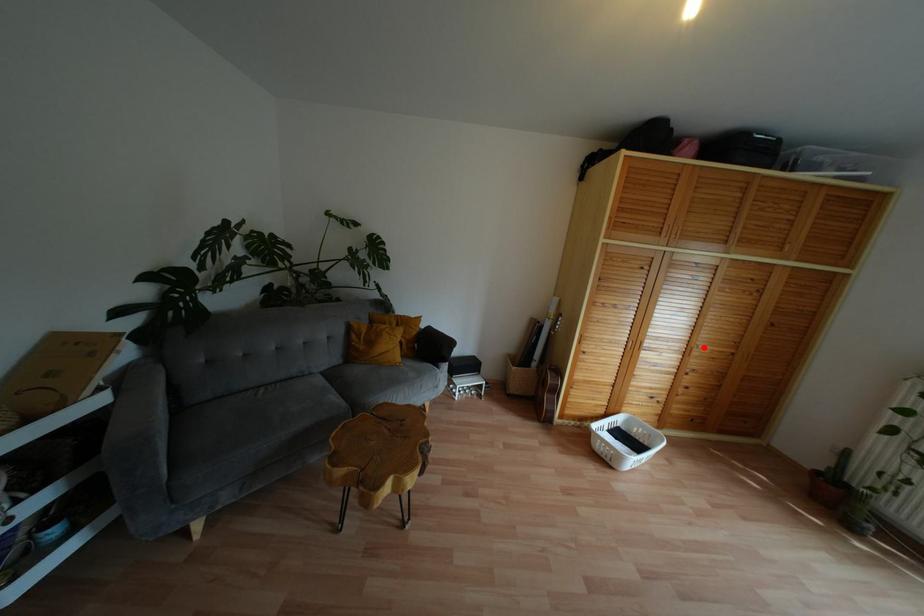
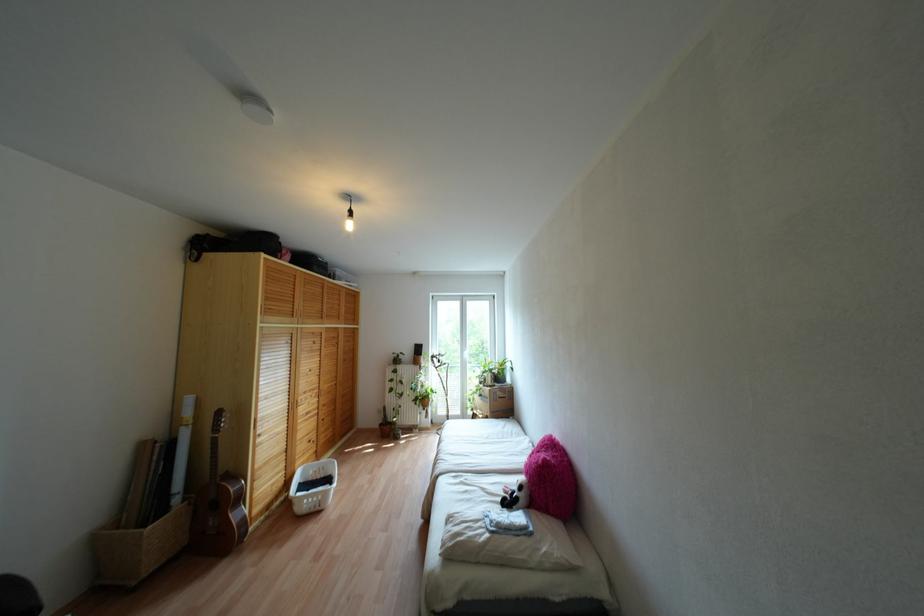
Find the pixel in the second image that matches the highlighted location in the first image.

(324, 387)